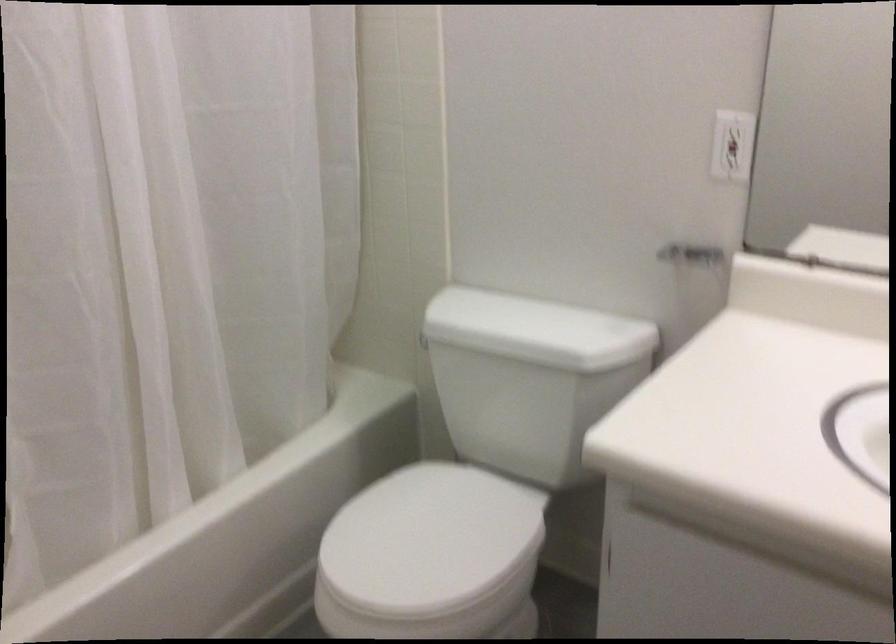
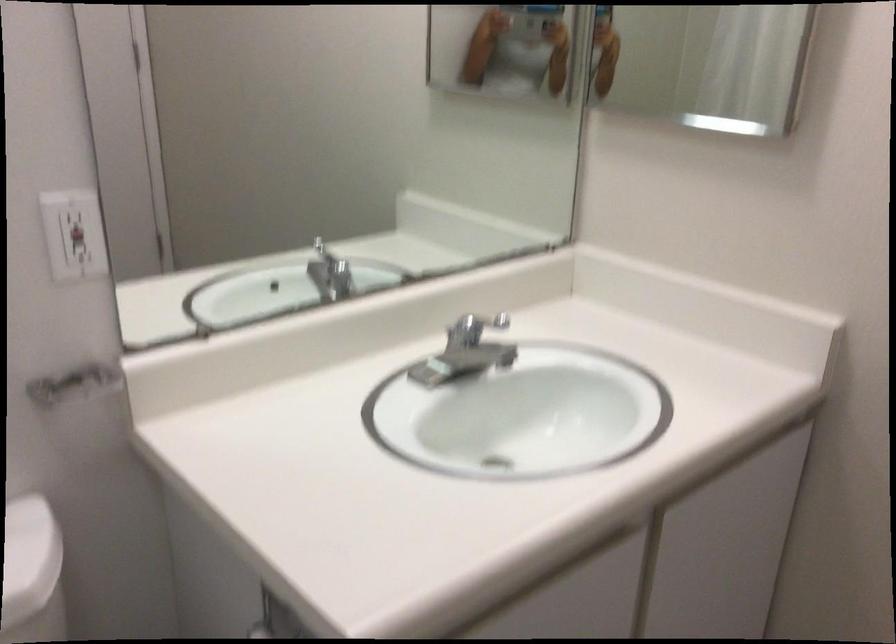
Find the pixel in the second image that matches point (736, 152) in the first image.

(76, 234)